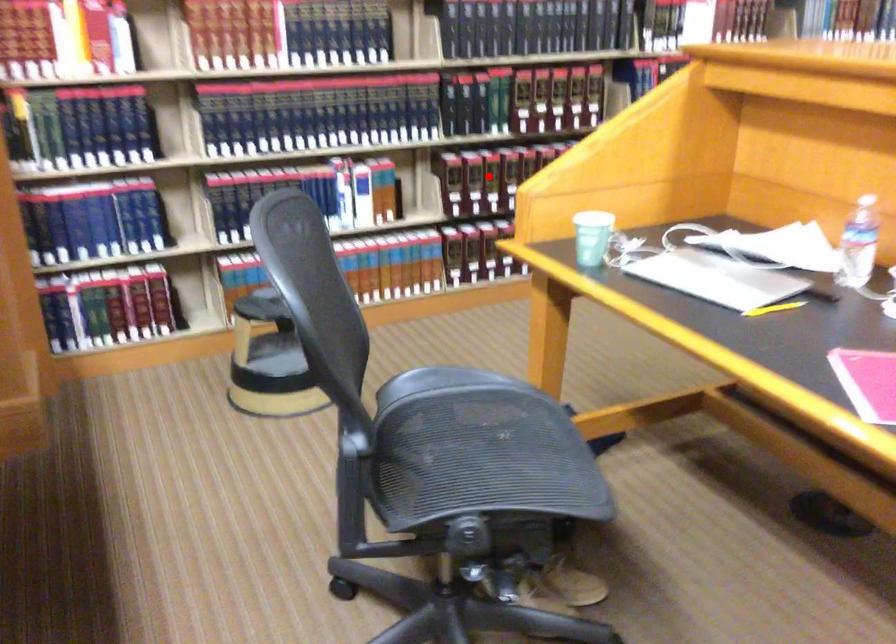
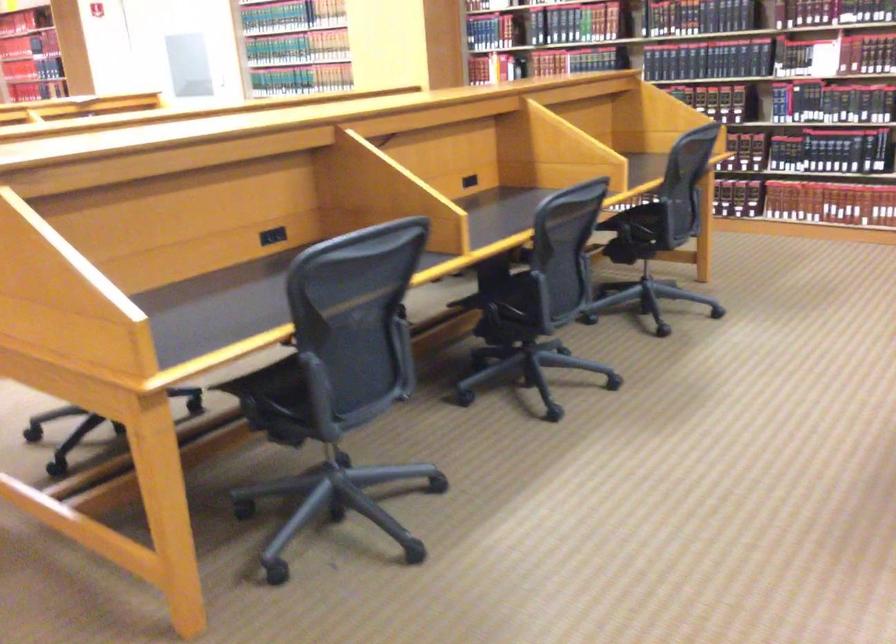
Question: I am providing you with two images of the same scene from different viewpoints. A red point is marked on the first image. Is the red point's position out of view in image 2?

Choices:
 (A) Yes
 (B) No

Answer: (A)